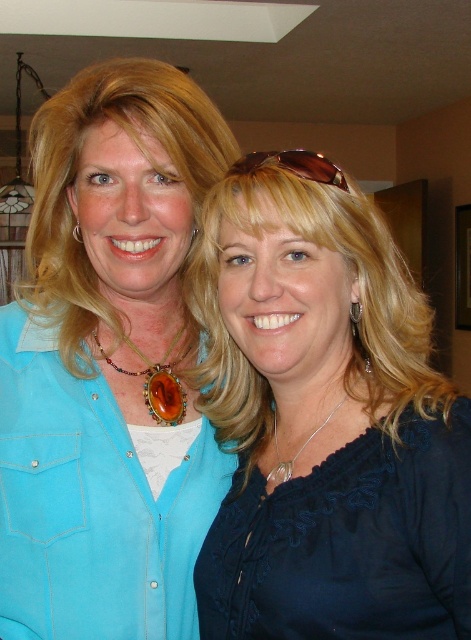
Question: Which is nearer to the matte blue shirt at center?

Choices:
 (A) amber stone necklace at center
 (B) satin navy blouse at center

Answer: (A)

Question: Does amber stone necklace at center appear over brown leather sunglasses at upper center?

Choices:
 (A) yes
 (B) no

Answer: (B)

Question: Can you confirm if matte blue shirt at center is wider than amber stone necklace at center?

Choices:
 (A) no
 (B) yes

Answer: (B)

Question: Which of these objects is positioned farthest from the matte blue shirt at center?

Choices:
 (A) amber stone necklace at center
 (B) brown leather sunglasses at upper center
 (C) silver metallic necklace at center
 (D) satin navy blouse at center

Answer: (B)

Question: Which point is closer to the camera?

Choices:
 (A) (30, 586)
 (B) (251, 172)
 (C) (324, 420)

Answer: (B)

Question: Does matte blue shirt at center appear on the left side of brown leather sunglasses at upper center?

Choices:
 (A) no
 (B) yes

Answer: (B)